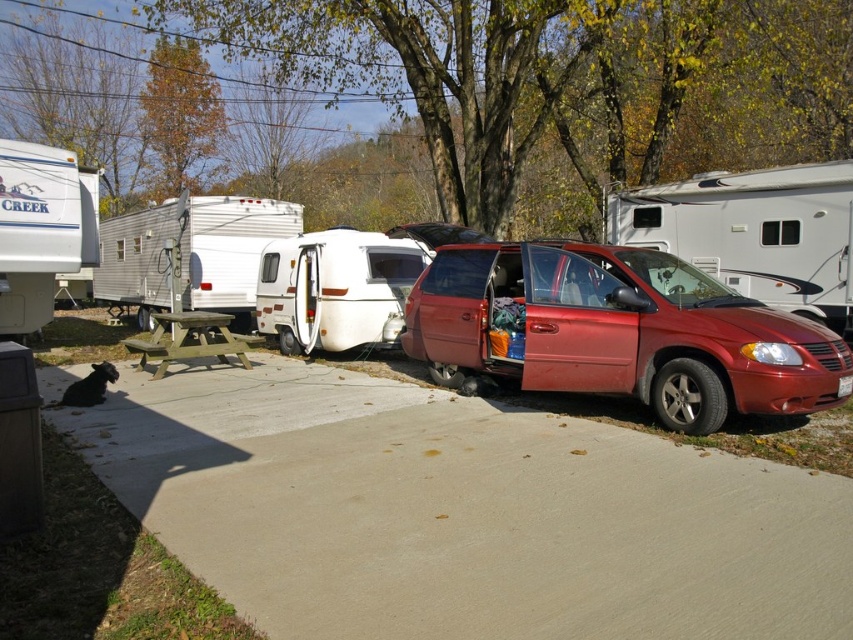
Between point (407, 308) and point (305, 330), which one is positioned behind?

The point (305, 330) is more distant.

Is shiny red minivan at center smaller than white glossy camper at center?

Incorrect, shiny red minivan at center is not smaller in size than white glossy camper at center.

Who is more forward, (744, 358) or (347, 316)?

Positioned in front is point (744, 358).

Image resolution: width=853 pixels, height=640 pixels. Find the location of `shiny red minivan at center`. shiny red minivan at center is located at coordinates (619, 332).

Does concrete at center have a smaller size compared to green wood picnic table at center?

Yes, concrete at center is smaller than green wood picnic table at center.

Between concrete at center and green wood picnic table at center, which one appears on the left side from the viewer's perspective?

From the viewer's perspective, green wood picnic table at center appears more on the left side.

Between point (416, 536) and point (148, 342), which one is positioned behind?

Positioned behind is point (148, 342).

Find the location of a particular element. Image resolution: width=853 pixels, height=640 pixels. concrete at center is located at coordinates (462, 513).

Consider the image. Is shiny red minivan at center shorter than white plastic camper at center?

Yes, shiny red minivan at center is shorter than white plastic camper at center.

Does point (735, 323) come closer to viewer compared to point (253, 298)?

Yes, point (735, 323) is in front of point (253, 298).

Which is in front, point (631, 296) or point (247, 248)?

Point (631, 296) is more forward.

At what (x,y) coordinates should I click in order to perform the action: click on shiny red minivan at center. Please return your answer as a coordinate pair (x, y). This screenshot has width=853, height=640. Looking at the image, I should click on (619, 332).